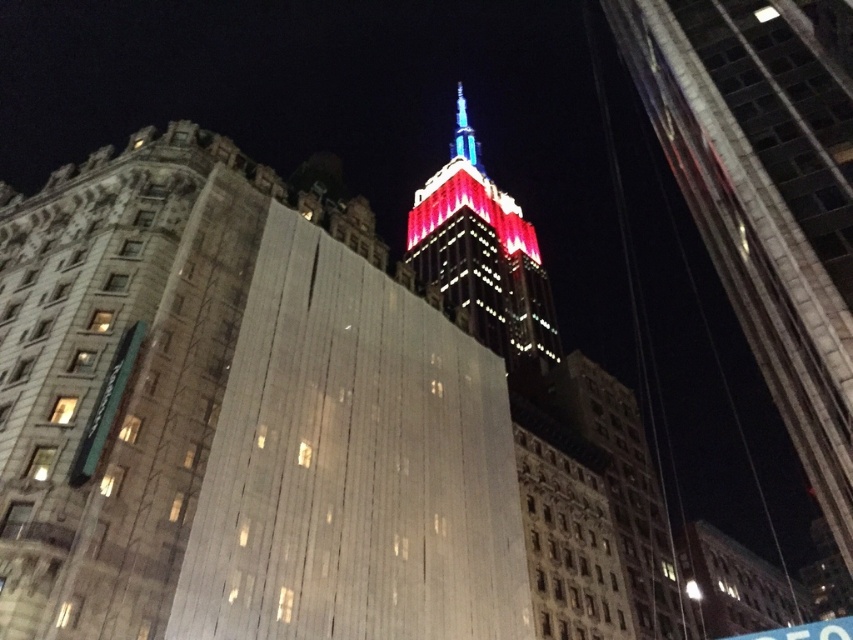
You are an architect analyzing the urban skyline. You observe the red glass tower at center and the shiny blue spire at center. Which of these two structures is located to the left when viewed from your perspective?

The red glass tower at center is positioned on the left side of the shiny blue spire at center, so it is located to the left when viewed from your perspective.

You are a city planner trying to install a new streetlight between the red glass tower at center and the shiny blue spire at center. The streetlight requires a minimum of 30 meters of space to be safely installed. Based on the scene, will there be enough space for the installation?

The red glass tower at center and shiny blue spire at center are 29.29 meters apart. Since the required space for the streetlight is 30 meters, there is insufficient space for the installation.